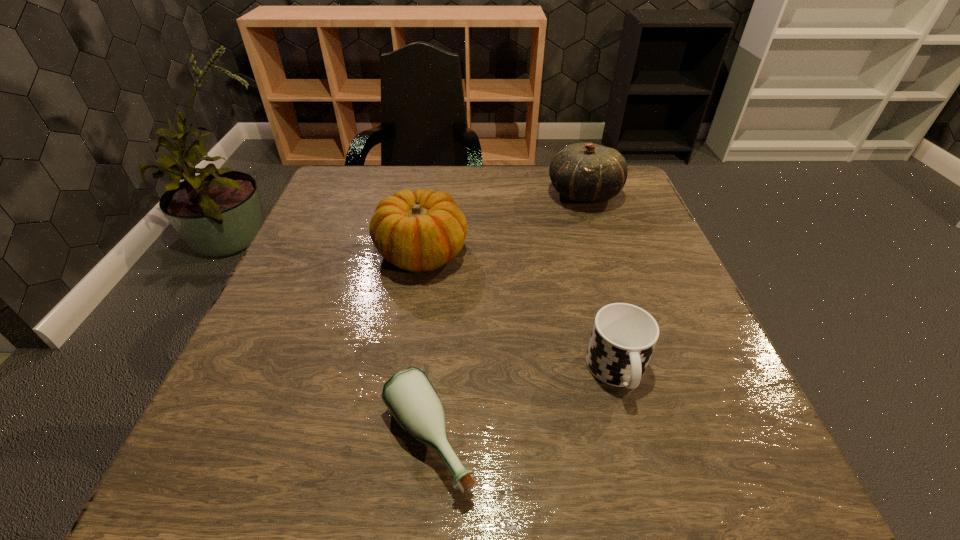
The height and width of the screenshot is (540, 960). I want to click on object that is at the far edge, so click(585, 172).

Locate an element on the screen. object positioned at the near edge is located at coordinates (409, 395).

The height and width of the screenshot is (540, 960). What are the coordinates of `gourd that is at the right edge` in the screenshot? It's located at (585, 172).

What are the coordinates of `cup present at the right edge` in the screenshot? It's located at pyautogui.click(x=623, y=337).

Where is `object located in the far right corner section of the desktop`? object located in the far right corner section of the desktop is located at coordinates click(x=585, y=172).

Image resolution: width=960 pixels, height=540 pixels. I want to click on vacant space at the far edge, so click(427, 173).

In the image, there is a desktop. At what (x,y) coordinates should I click in order to perform the action: click on vacant area at the near edge. Please return your answer as a coordinate pair (x, y). Looking at the image, I should click on (607, 443).

In the image, there is a desktop. In order to click on vacant space at the left edge in this screenshot , I will do `click(323, 356)`.

At what (x,y) coordinates should I click in order to perform the action: click on free location at the right edge. Please return your answer as a coordinate pair (x, y). This screenshot has height=540, width=960. Looking at the image, I should click on (x=681, y=281).

At what (x,y) coordinates should I click in order to perform the action: click on vacant region at the near left corner of the desktop. Please return your answer as a coordinate pair (x, y). Image resolution: width=960 pixels, height=540 pixels. Looking at the image, I should click on (184, 469).